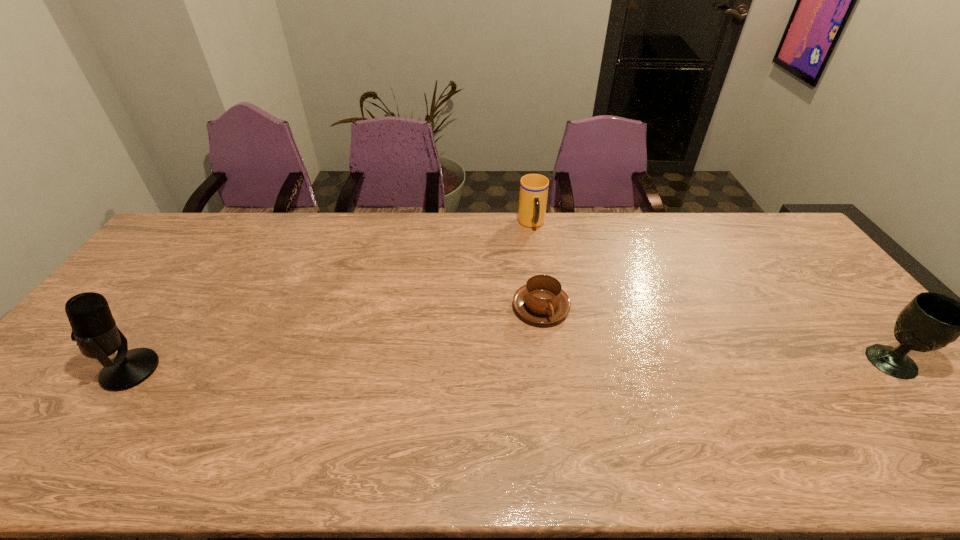
Where is `microphone`? microphone is located at coordinates tap(94, 329).

The width and height of the screenshot is (960, 540). I want to click on the leftmost object, so click(x=94, y=329).

Identify the location of the rightmost object. (931, 321).

Locate an element on the screen. This screenshot has width=960, height=540. the third shortest object is located at coordinates (931, 321).

Where is `the third tallest object`? Image resolution: width=960 pixels, height=540 pixels. the third tallest object is located at coordinates (533, 195).

Identify the location of the farthest object. (533, 195).

The image size is (960, 540). What are the coordinates of `the second farthest object` in the screenshot? It's located at (541, 300).

This screenshot has height=540, width=960. Identify the location of the shortest object. (541, 300).

The width and height of the screenshot is (960, 540). Identify the location of vacant space located 0.050m on the stand of the tallest object. (85, 370).

Locate an element on the screen. The image size is (960, 540). vacant point located 0.210m on the left of the chalice is located at coordinates (788, 362).